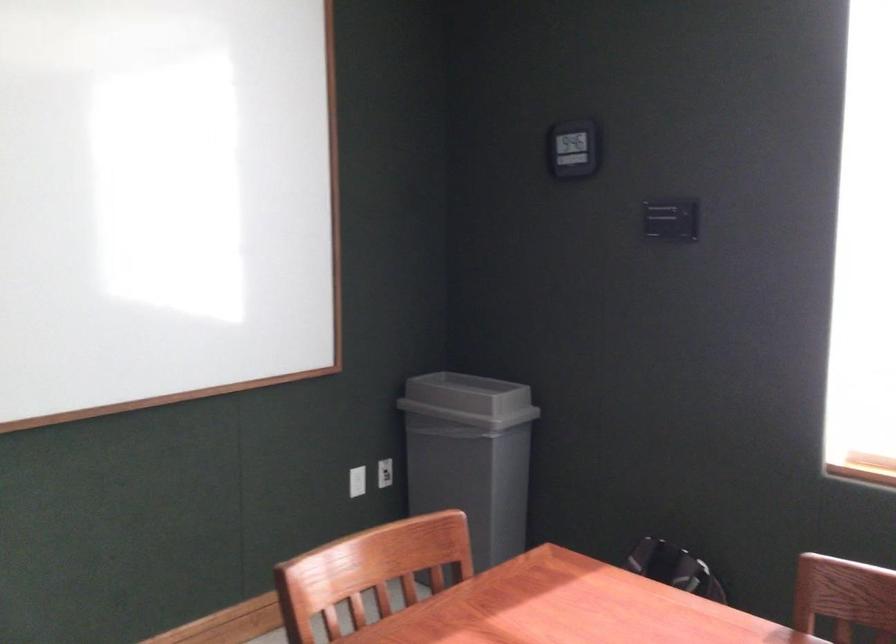
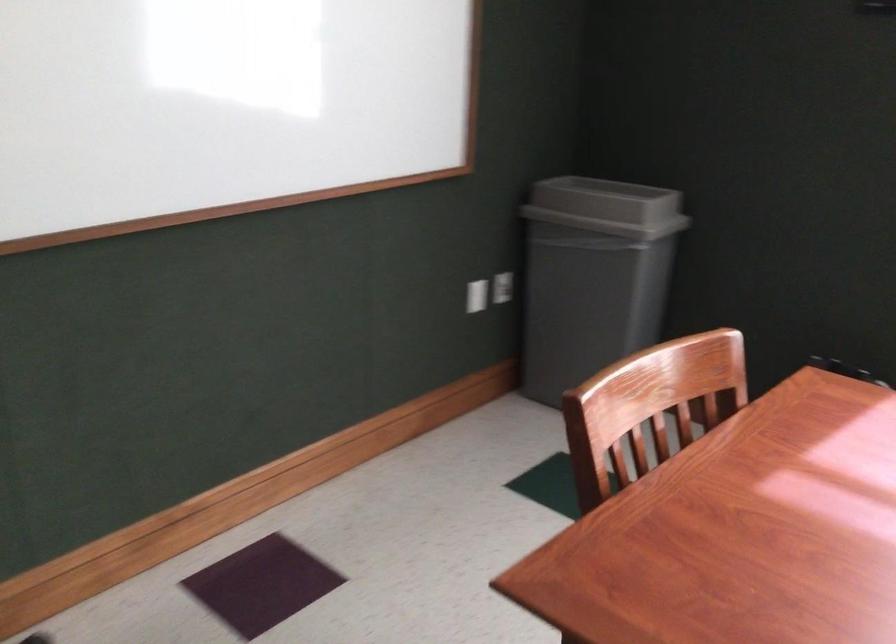
Where in the second image is the point corresponding to (359,482) from the first image?

(477, 295)